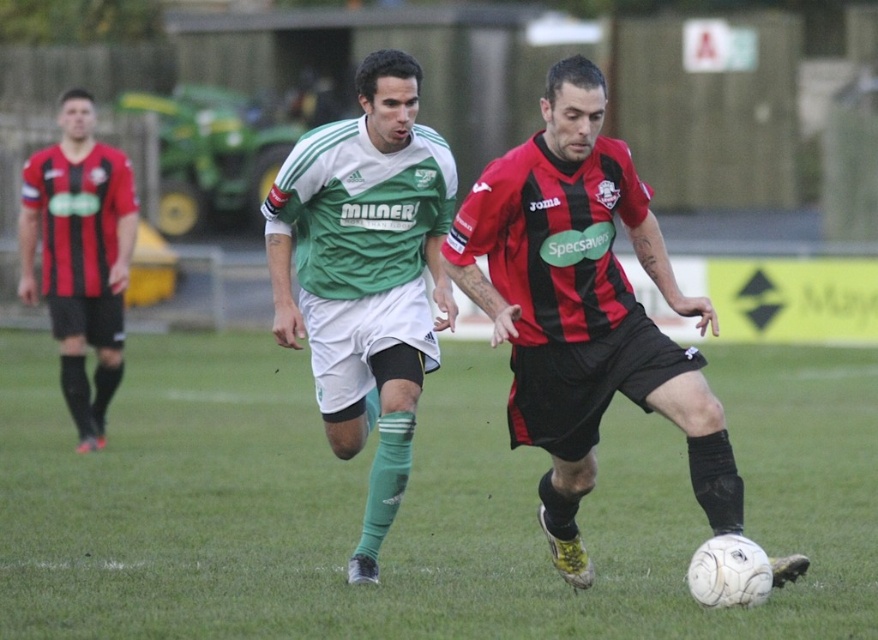
Question: Can you confirm if green grass at center is smaller than red/black striped jersey at left?

Choices:
 (A) yes
 (B) no

Answer: (B)

Question: Which object is positioned closest to the green grass at center?

Choices:
 (A) red-black striped jersey at center
 (B) red/black striped jersey at left

Answer: (B)

Question: Which point is farther from the camera taking this photo?

Choices:
 (A) (866, 518)
 (B) (588, 289)
 (C) (358, 192)

Answer: (A)

Question: Does green grass at center lie behind green matte jersey at center?

Choices:
 (A) yes
 (B) no

Answer: (B)

Question: Does red-black striped jersey at center appear under red/black striped jersey at left?

Choices:
 (A) yes
 (B) no

Answer: (A)

Question: Among these points, which one is nearest to the camera?

Choices:
 (A) (124, 285)
 (B) (426, 364)
 (C) (858, 580)

Answer: (B)